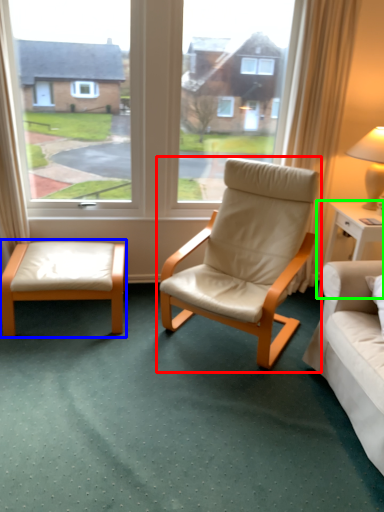
Question: Which object is the closest to the chair (highlighted by a red box)? Choose among these: table (highlighted by a blue box) or nightstand (highlighted by a green box).

Choices:
 (A) table
 (B) nightstand

Answer: (B)